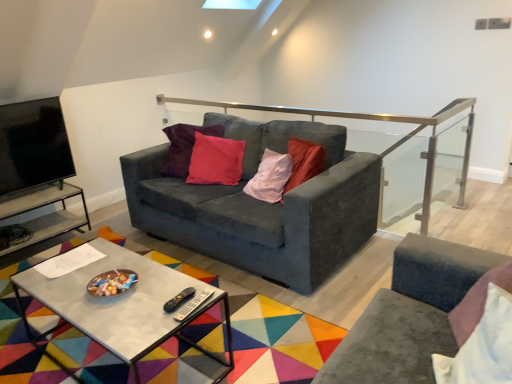
Question: Is matte black tv stand at left positioned with its back to satin silver rail at upper center?

Choices:
 (A) no
 (B) yes

Answer: (A)

Question: Is matte black tv stand at left facing towards satin silver rail at upper center?

Choices:
 (A) yes
 (B) no

Answer: (B)

Question: Is matte black tv stand at left shorter than satin silver rail at upper center?

Choices:
 (A) no
 (B) yes

Answer: (B)

Question: Considering the relative sizes of matte black tv stand at left and satin silver rail at upper center in the image provided, is matte black tv stand at left bigger than satin silver rail at upper center?

Choices:
 (A) no
 (B) yes

Answer: (A)

Question: Is matte black tv stand at left smaller than satin silver rail at upper center?

Choices:
 (A) yes
 (B) no

Answer: (A)

Question: From a real-world perspective, is matte black tv stand at left on top of satin silver rail at upper center?

Choices:
 (A) no
 (B) yes

Answer: (B)

Question: Is white soft pillow at lower right touching satin silver rail at upper center?

Choices:
 (A) no
 (B) yes

Answer: (A)

Question: From a real-world perspective, is white soft pillow at lower right over satin silver rail at upper center?

Choices:
 (A) no
 (B) yes

Answer: (B)

Question: Could you tell me if white soft pillow at lower right is turned towards satin silver rail at upper center?

Choices:
 (A) no
 (B) yes

Answer: (A)

Question: Is white soft pillow at lower right shorter than satin silver rail at upper center?

Choices:
 (A) no
 (B) yes

Answer: (B)

Question: Is white soft pillow at lower right outside of satin silver rail at upper center?

Choices:
 (A) yes
 (B) no

Answer: (A)

Question: Is white soft pillow at lower right thinner than satin silver rail at upper center?

Choices:
 (A) no
 (B) yes

Answer: (A)

Question: Can you confirm if satin silver rail at upper center is positioned to the right of velvet dark gray couch at center?

Choices:
 (A) yes
 (B) no

Answer: (A)